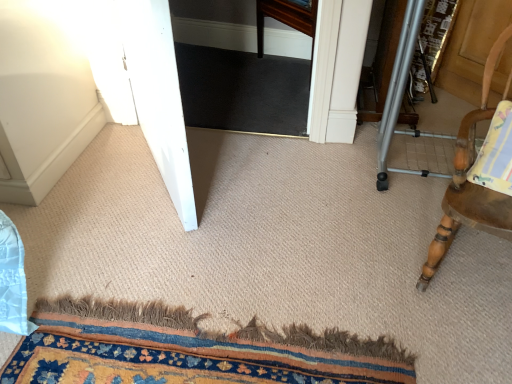
Question: Looking at their shapes, would you say carpeted mat at lower center is wider or thinner than white glossy screen door at left?

Choices:
 (A) thin
 (B) wide

Answer: (B)

Question: In the image, is carpeted mat at lower center on the left side or the right side of white glossy screen door at left?

Choices:
 (A) left
 (B) right

Answer: (B)

Question: Which object is the farthest from the white glossy screen door at left?

Choices:
 (A) carpeted mat at lower center
 (B) wooden chair with striped cushion at right

Answer: (B)

Question: Estimate the real-world distances between objects in this image. Which object is closer to the carpeted mat at lower center?

Choices:
 (A) wooden chair with striped cushion at right
 (B) white glossy screen door at left

Answer: (A)